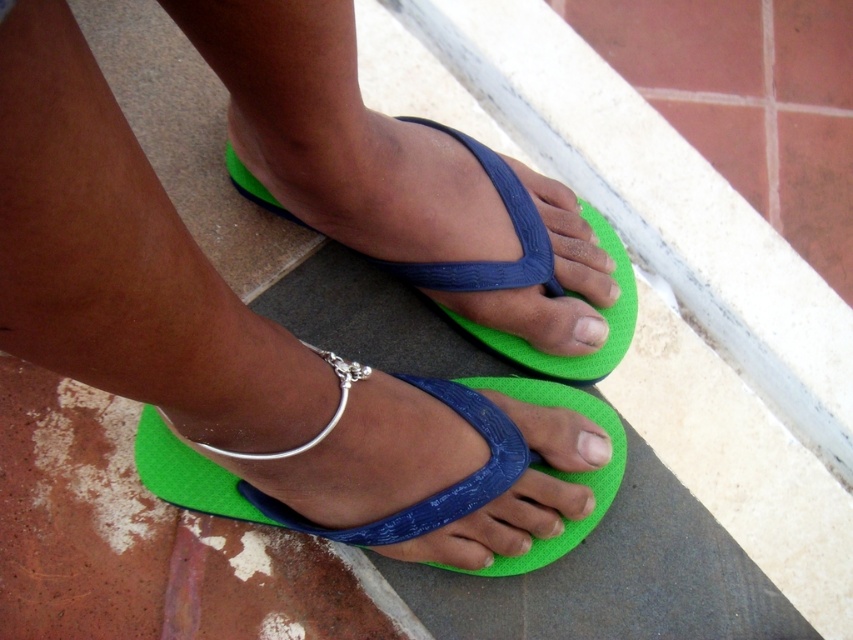
Question: Is green rubber flip-flop at center positioned in front of white matte toe at center?

Choices:
 (A) no
 (B) yes

Answer: (B)

Question: Which point is farther to the camera?

Choices:
 (A) green rubber flip-flop at center
 (B) silver metallic anklet at center

Answer: (A)

Question: Does silver metallic anklet at center have a larger size compared to white matte toe at center?

Choices:
 (A) no
 (B) yes

Answer: (B)

Question: Can you confirm if silver metallic anklet at center is smaller than matte blue toe at center?

Choices:
 (A) yes
 (B) no

Answer: (B)

Question: Which object is the closest to the white matte toe at center?

Choices:
 (A) green rubber flip-flops at center
 (B) matte blue toe at center
 (C) green rubber flip-flop at center
 (D) silver metallic bracelet at center

Answer: (B)

Question: Which point appears farthest from the camera in this image?

Choices:
 (A) (573, 323)
 (B) (527, 442)
 (C) (395, 269)

Answer: (A)